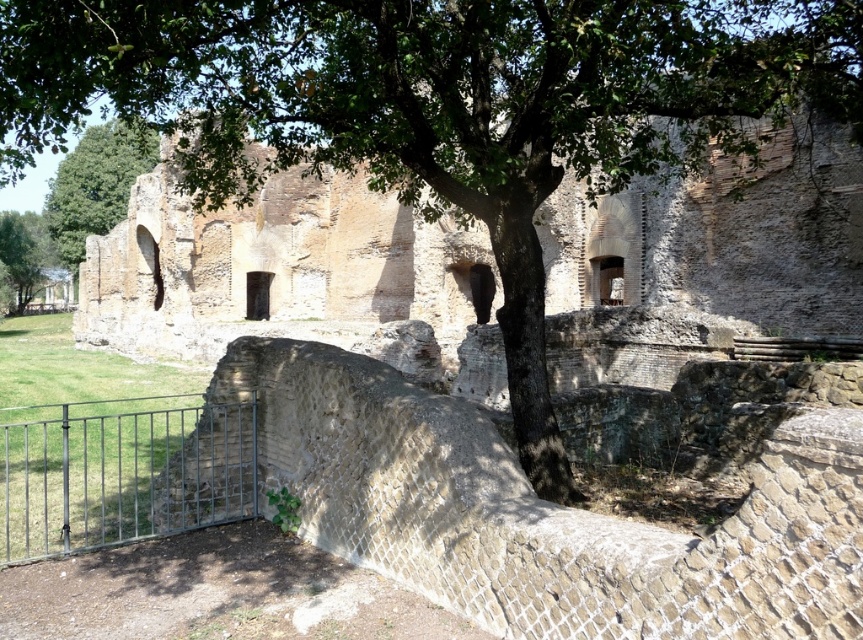
Question: Which point is closer to the camera taking this photo?

Choices:
 (A) (142, 454)
 (B) (9, 237)
 (C) (104, 173)

Answer: (A)

Question: Does green leafy tree at upper left have a larger size compared to green leafy tree at lower left?

Choices:
 (A) yes
 (B) no

Answer: (A)

Question: Is metallic gate at lower left below green leafy tree at upper left?

Choices:
 (A) yes
 (B) no

Answer: (A)

Question: Which is farther from the metallic gate at lower left?

Choices:
 (A) green leafy tree at upper left
 (B) green leafy tree at lower left

Answer: (B)

Question: Based on their relative distances, which object is farther from the green leafy tree at lower left?

Choices:
 (A) green leafy tree at upper left
 (B) metallic gate at lower left

Answer: (B)

Question: Where is green leafy tree at upper left located in relation to green leafy tree at lower left in the image?

Choices:
 (A) left
 (B) right

Answer: (B)